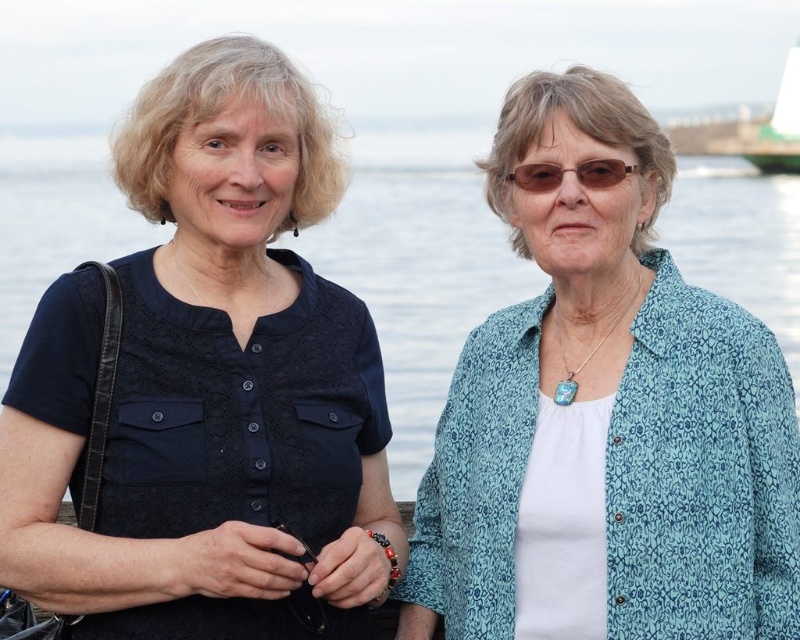
Question: Considering the real-world distances, which object is farthest from the blue patterned shirt at right?

Choices:
 (A) matte black blouse at left
 (B) brown plastic glasses at center
 (C) green matte boat at upper right
 (D) transparent water at center

Answer: (C)

Question: Which point appears farthest from the camera in this image?

Choices:
 (A) click(564, 172)
 (B) click(708, 321)
 (C) click(20, 502)
 (D) click(500, 225)

Answer: (D)

Question: Is the position of matte black blouse at left less distant than that of green matte boat at upper right?

Choices:
 (A) yes
 (B) no

Answer: (A)

Question: Can you confirm if matte black blouse at left is positioned to the left of green matte boat at upper right?

Choices:
 (A) no
 (B) yes

Answer: (B)

Question: Is blue patterned shirt at right positioned behind green matte boat at upper right?

Choices:
 (A) yes
 (B) no

Answer: (B)

Question: Which of the following is the farthest from the observer?

Choices:
 (A) brown plastic glasses at center
 (B) matte black blouse at left
 (C) blue patterned shirt at right
 (D) green matte boat at upper right

Answer: (D)